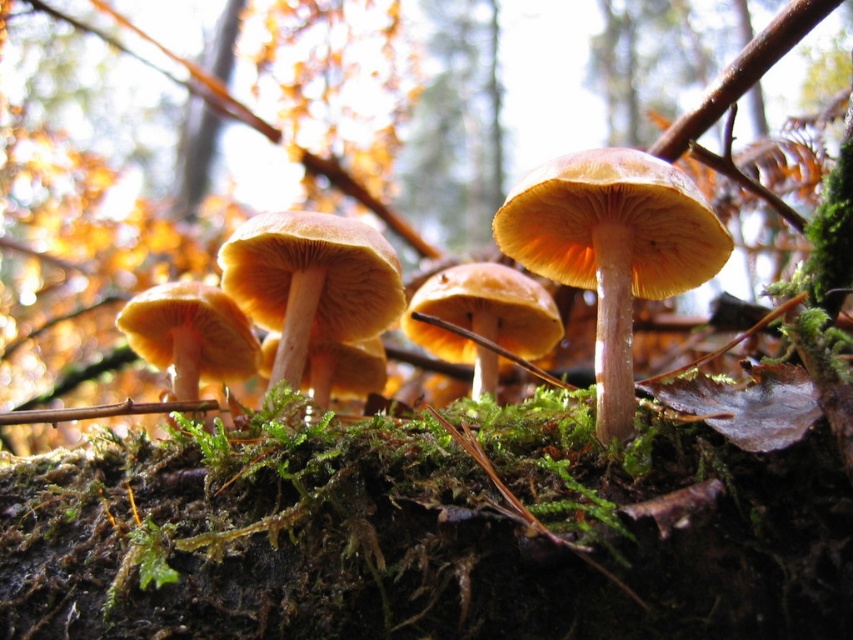
Question: Does shiny orange mushroom at center appear under light brown smooth mushroom at center?

Choices:
 (A) no
 (B) yes

Answer: (A)

Question: Which point is closer to the camera taking this photo?

Choices:
 (A) (444, 333)
 (B) (561, 205)

Answer: (B)

Question: Which point is farther to the camera?

Choices:
 (A) shiny orange mushroom at center
 (B) light brown smooth mushroom at center

Answer: (B)

Question: From the image, what is the correct spatial relationship of shiny orange mushroom at center in relation to light brown smooth mushroom at center?

Choices:
 (A) left
 (B) right

Answer: (B)

Question: In this image, where is shiny orange mushroom at center located relative to light brown smooth mushroom at center?

Choices:
 (A) below
 (B) above

Answer: (B)